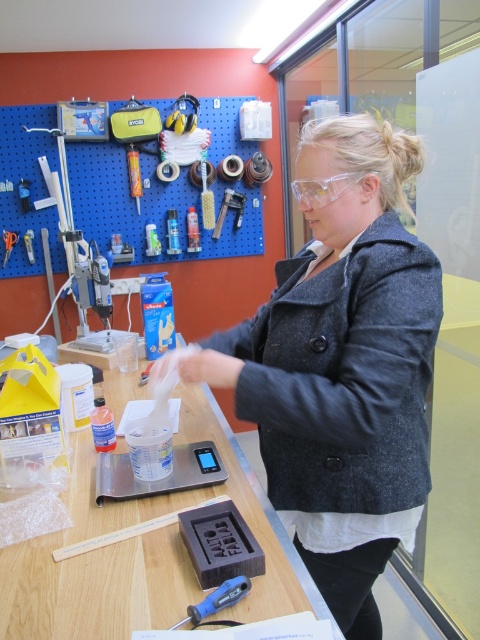
You are organizing tools on a workbench and need to place the metallic silver scale at center and the brushed metal scissors at upper left. Given their sizes, which tool requires more space on the workbench?

The metallic silver scale at center requires more space on the workbench because it has a larger size compared to the brushed metal scissors at upper left.

You are a technician who needs to choose a screwdriver for a small, delicate task. Which one between the blue plastic screwdriver at lower center and the metallic screwdriver at upper center would be more suitable?

The blue plastic screwdriver at lower center has a smaller size compared to the metallic screwdriver at upper center, making it more suitable for small, delicate tasks.

You are a worker who needs to place a 12 inch long tool on the wooden table at center. The gray woolen coat at center is currently in the way. Can you place the tool on the table without moving the coat?

The distance between the gray woolen coat at center and the wooden table at center is 14.74 inches. Since the tool is only 12 inches long, it can be placed on the table without needing to move the coat as there is enough space.